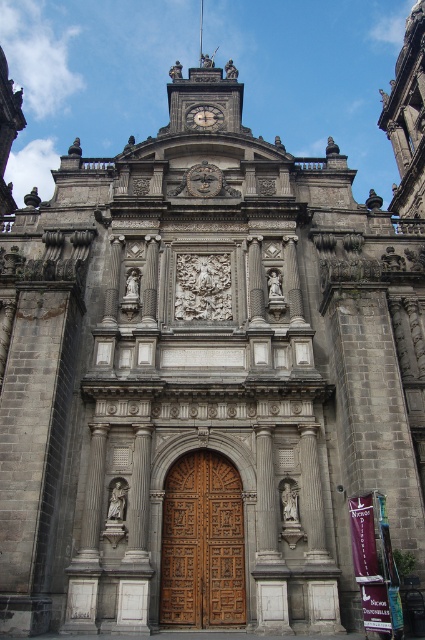
You are standing in front of the historic stone church and want to take a photo of both the wooden carved door at center and the silver metallic clock at upper center. Which object should you focus on first to ensure both are in frame?

You should focus on the wooden carved door at center first since it is closer to the viewer than the silver metallic clock at upper center, ensuring both are within the camera frame.

You are an architect visiting the historic church and want to compare the sizes of the wooden carved door at center and the silver metallic clock at upper center. Based on the scene, which object is bigger?

The wooden carved door at center is larger in size than the silver metallic clock at upper center.